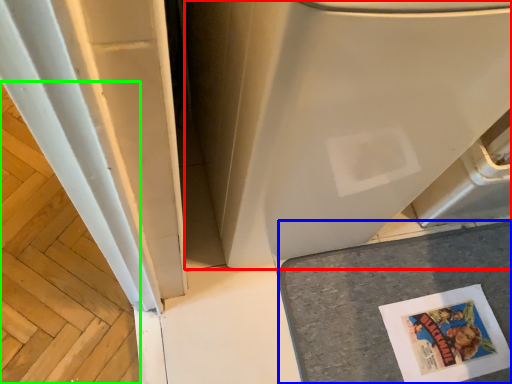
Question: Which object is the closest to the water heater (highlighted by a red box)? Choose among these: counter top (highlighted by a blue box) or wood (highlighted by a green box).

Choices:
 (A) counter top
 (B) wood

Answer: (A)